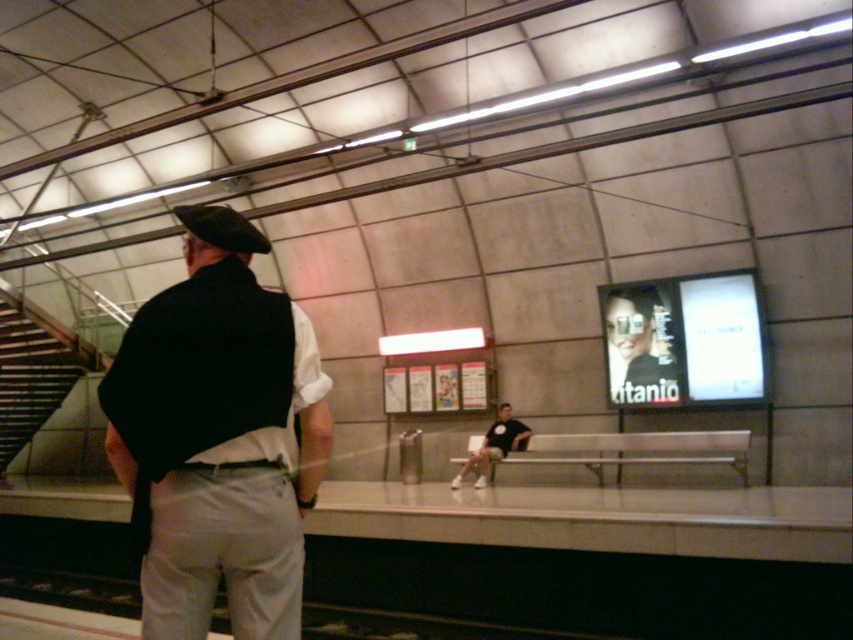
Looking at this image, you are standing at the point marked as point (15, 317) in the subway station. You want to know how far you are from the viewer. Please state the distance in meters.

The distance between point (15, 317) and the viewer is 12.62 meters.

You are a person trying to find a place to sit in the subway station. You see the dark gray fabric vest at center and the wooden stairs at left. Which one is a better option for sitting?

The wooden stairs at left are a better option for sitting because the dark gray fabric vest at center occupies less space and is likely not designed for sitting.